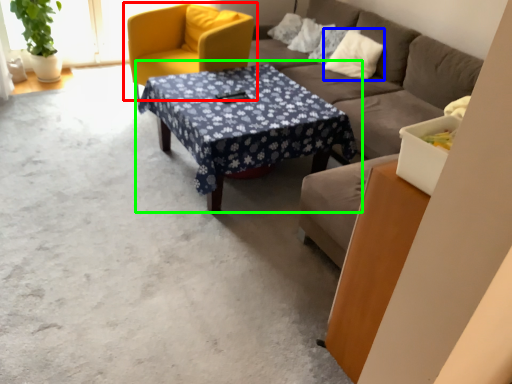
Question: Which is farther away from chair (highlighted by a red box)? pillow (highlighted by a blue box) or coffee table (highlighted by a green box)?

Choices:
 (A) pillow
 (B) coffee table

Answer: (A)